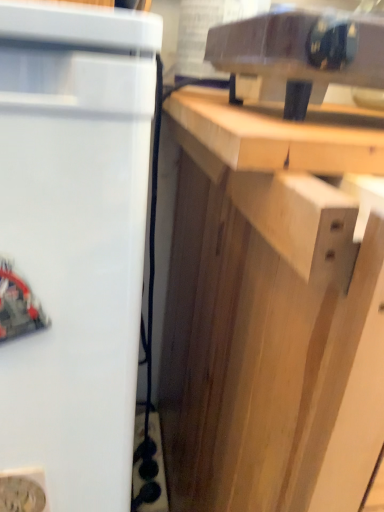
Question: Considering the positions of light wood cabinet at center and light brown wood at upper right in the image, is light wood cabinet at center bigger or smaller than light brown wood at upper right?

Choices:
 (A) small
 (B) big

Answer: (B)

Question: From their relative heights in the image, would you say light wood cabinet at center is taller or shorter than light brown wood at upper right?

Choices:
 (A) tall
 (B) short

Answer: (A)

Question: Which object is positioned farthest from the white matte refrigerator at left?

Choices:
 (A) transparent plastic container at upper center
 (B) light brown wood at upper right
 (C) light wood cabinet at center

Answer: (A)

Question: Estimate the real-world distances between objects in this image. Which object is closer to the transparent plastic container at upper center?

Choices:
 (A) light wood cabinet at center
 (B) light brown wood at upper right
 (C) white matte refrigerator at left

Answer: (B)